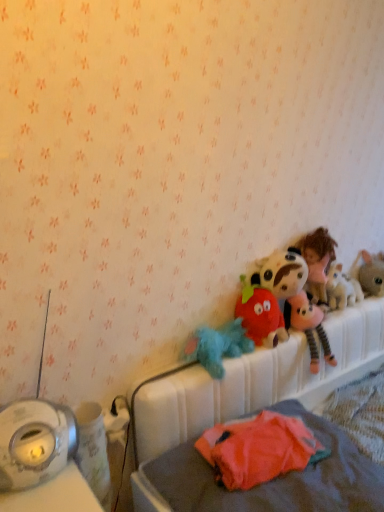
What do you see at coordinates (260, 315) in the screenshot? The height and width of the screenshot is (512, 384). I see `fluffy plush strawberry at center, arranged as the 3th toy when viewed from the right` at bounding box center [260, 315].

This screenshot has height=512, width=384. What are the coordinates of `white plastic hospital bed at upper right` in the screenshot? It's located at (252, 386).

Describe the element at coordinates (369, 273) in the screenshot. I see `fluffy gray rabbit at right, the fifth toy positioned from the left` at that location.

Identify the location of orange fabric stuffed toy at lower right, which is the second toy in left-to-right order. The height and width of the screenshot is (512, 384). (258, 449).

I want to click on fluffy blue plush at center, the fifth toy viewed from the right, so click(217, 346).

This screenshot has height=512, width=384. What do you see at coordinates (217, 346) in the screenshot?
I see `fluffy blue plush at center, the fifth toy viewed from the right` at bounding box center [217, 346].

At what (x,y) coordinates should I click in order to perform the action: click on fluffy plush strawberry at center, which is the third toy in left-to-right order. Please return your answer as a coordinate pair (x, y). The height and width of the screenshot is (512, 384). Looking at the image, I should click on (260, 315).

Which is more distant, (220, 426) or (335, 289)?

Positioned behind is point (335, 289).

Where is `the 3rd toy above when counting from the orange fabric stuffed toy at lower right, the 4th toy positioned from the right (from the image's perspective)`? Image resolution: width=384 pixels, height=512 pixels. the 3rd toy above when counting from the orange fabric stuffed toy at lower right, the 4th toy positioned from the right (from the image's perspective) is located at coordinates (342, 289).

How much distance is there between orange fabric stuffed toy at lower right, which is the second toy in left-to-right order, and fluffy plush toy at upper right, which is the second toy from right to left?

26.37 inches.

Does orange fabric stuffed toy at lower right, which is the second toy in left-to-right order, appear on the right side of fluffy plush toy at upper right, which is the second toy from right to left?

No.

Which object is positioned more to the left, fluffy plush toy at upper right, which is the second toy from right to left, or fluffy pink plush at upper right?

Positioned to the left is fluffy pink plush at upper right.

Is fluffy plush toy at upper right, arranged as the fourth toy when viewed from the left, far from fluffy pink plush at upper right?

No, fluffy plush toy at upper right, arranged as the fourth toy when viewed from the left, is not far away from fluffy pink plush at upper right.

Find the location of `the 1st toy behind the fluffy pink plush at upper right, counting from the anchor's position`. the 1st toy behind the fluffy pink plush at upper right, counting from the anchor's position is located at coordinates (342, 289).

Choose the correct answer: Is fluffy plush toy at upper right, which is the second toy from right to left, inside fluffy pink plush at upper right or outside it?

fluffy plush toy at upper right, which is the second toy from right to left, is inside fluffy pink plush at upper right.

Who is shorter, white plastic hospital bed at upper right or orange fabric stuffed toy at lower right, which is the second toy in left-to-right order?

With less height is orange fabric stuffed toy at lower right, which is the second toy in left-to-right order.

Considering the sizes of white plastic hospital bed at upper right and orange fabric stuffed toy at lower right, which is the second toy in left-to-right order, in the image, is white plastic hospital bed at upper right bigger or smaller than orange fabric stuffed toy at lower right, which is the second toy in left-to-right order,?

In the image, white plastic hospital bed at upper right appears to be larger than orange fabric stuffed toy at lower right, which is the second toy in left-to-right order.

Image resolution: width=384 pixels, height=512 pixels. There is a white plastic hospital bed at upper right. What are the coordinates of `the 1st toy above it (from a real-world perspective)` in the screenshot? It's located at (258, 449).

Can you confirm if white plastic hospital bed at upper right is thinner than orange fabric stuffed toy at lower right, which is the second toy in left-to-right order?

No.

From the picture: Is fluffy blue plush at center, placed as the first toy when sorted from left to right, directly adjacent to white plastic hospital bed at upper right?

No, fluffy blue plush at center, placed as the first toy when sorted from left to right, is not with white plastic hospital bed at upper right.

Is fluffy blue plush at center, placed as the first toy when sorted from left to right, to the right of white plastic hospital bed at upper right from the viewer's perspective?

No.

Can you tell me how much fluffy blue plush at center, the fifth toy viewed from the right, and white plastic hospital bed at upper right differ in facing direction?

The angle between the facing direction of fluffy blue plush at center, the fifth toy viewed from the right, and the facing direction of white plastic hospital bed at upper right is 0.000748 degrees.

Is fluffy blue plush at center, the fifth toy viewed from the right, oriented towards white plastic hospital bed at upper right?

No, fluffy blue plush at center, the fifth toy viewed from the right, is not turned towards white plastic hospital bed at upper right.

Is orange fabric stuffed toy at lower right, which is the second toy in left-to-right order, facing away from fluffy gray rabbit at right, the fifth toy positioned from the left?

No, orange fabric stuffed toy at lower right, which is the second toy in left-to-right order, is not facing the opposite direction of fluffy gray rabbit at right, the fifth toy positioned from the left.

From the image's perspective, who appears lower, orange fabric stuffed toy at lower right, the 4th toy positioned from the right, or fluffy gray rabbit at right, the fifth toy positioned from the left?

orange fabric stuffed toy at lower right, the 4th toy positioned from the right, appears lower in the image.

The width and height of the screenshot is (384, 512). I want to click on toy that is the 4th object located behind the orange fabric stuffed toy at lower right, which is the second toy in left-to-right order, so click(x=369, y=273).

From the picture: Is fluffy gray rabbit at right, which is the 1th toy in right-to-left order, completely or partially inside orange fabric stuffed toy at lower right, which is the second toy in left-to-right order?

Definitely not — fluffy gray rabbit at right, which is the 1th toy in right-to-left order, is not inside orange fabric stuffed toy at lower right, which is the second toy in left-to-right order.

Between fluffy plush toy at upper right, arranged as the fourth toy when viewed from the left, and white plastic hospital bed at upper right, which one is positioned in front?

white plastic hospital bed at upper right is more forward.

From the image's perspective, is fluffy plush toy at upper right, which is the second toy from right to left, on white plastic hospital bed at upper right?

Yes.

Is fluffy plush toy at upper right, arranged as the fourth toy when viewed from the left, wider or thinner than white plastic hospital bed at upper right?

fluffy plush toy at upper right, arranged as the fourth toy when viewed from the left, is thinner than white plastic hospital bed at upper right.

The width and height of the screenshot is (384, 512). In the image, there is a fluffy plush toy at upper right, arranged as the fourth toy when viewed from the left. Find the location of `hospital bed below it (from a real-world perspective)`. hospital bed below it (from a real-world perspective) is located at coordinates (252, 386).

Can you confirm if fluffy plush toy at upper right, which is the second toy from right to left, is shorter than fluffy plush strawberry at center, which is the third toy in left-to-right order?

Yes.

Is fluffy plush toy at upper right, arranged as the fourth toy when viewed from the left, not within fluffy plush strawberry at center, arranged as the 3th toy when viewed from the right?

That's correct, fluffy plush toy at upper right, arranged as the fourth toy when viewed from the left, is outside of fluffy plush strawberry at center, arranged as the 3th toy when viewed from the right.

From the image's perspective, between fluffy plush toy at upper right, which is the second toy from right to left, and fluffy plush strawberry at center, arranged as the 3th toy when viewed from the right, which one is located above?

fluffy plush toy at upper right, which is the second toy from right to left, is shown above in the image.

From the fluffy plush toy at upper right, which is the second toy from right to left, count the 1st toy to the left and point to it. Please provide its 2D coordinates.

[(260, 315)]

Which toy is the 2nd one when counting from the left side of the fluffy plush toy at upper right, arranged as the fourth toy when viewed from the left? Please provide its 2D coordinates.

[(258, 449)]

Locate an element on the screen. The width and height of the screenshot is (384, 512). the 3rd toy located beneath the fluffy pink plush at upper right (from a real-world perspective) is located at coordinates (342, 289).

Which object lies further to the anchor point fluffy plush toy at upper right, which is the second toy from right to left, orange fabric stuffed toy at lower right, the 4th toy positioned from the right, or white plastic hospital bed at upper right?

orange fabric stuffed toy at lower right, the 4th toy positioned from the right.

Looking at the image, which one is located further to fluffy plush strawberry at center, arranged as the 3th toy when viewed from the right, white plastic hospital bed at upper right or fluffy gray rabbit at right, which is the 1th toy in right-to-left order?

fluffy gray rabbit at right, which is the 1th toy in right-to-left order, lies further to fluffy plush strawberry at center, arranged as the 3th toy when viewed from the right, than the other object.

In the scene shown: From the image, which object appears to be farther from fluffy plush toy at upper right, arranged as the fourth toy when viewed from the left, orange fabric stuffed toy at lower right, which is the second toy in left-to-right order, or fluffy gray rabbit at right, which is the 1th toy in right-to-left order?

orange fabric stuffed toy at lower right, which is the second toy in left-to-right order.

Which object lies nearer to the anchor point white plastic hospital bed at upper right, fluffy blue plush at center, placed as the first toy when sorted from left to right, or fluffy gray rabbit at right, the fifth toy positioned from the left?

fluffy blue plush at center, placed as the first toy when sorted from left to right.

Based on their spatial positions, is fluffy pink plush at upper right or fluffy gray rabbit at right, which is the 1th toy in right-to-left order, closer to orange fabric stuffed toy at lower right, the 4th toy positioned from the right?

The object closer to orange fabric stuffed toy at lower right, the 4th toy positioned from the right, is fluffy pink plush at upper right.

From the image, which object appears to be nearer to orange fabric stuffed toy at lower right, which is the second toy in left-to-right order, fluffy blue plush at center, placed as the first toy when sorted from left to right, or white plastic hospital bed at upper right?

Among the two, white plastic hospital bed at upper right is located nearer to orange fabric stuffed toy at lower right, which is the second toy in left-to-right order.

Which object lies nearer to the anchor point fluffy plush toy at upper right, arranged as the fourth toy when viewed from the left, orange fabric stuffed toy at lower right, the 4th toy positioned from the right, or fluffy blue plush at center, placed as the first toy when sorted from left to right?

fluffy blue plush at center, placed as the first toy when sorted from left to right, lies closer to fluffy plush toy at upper right, arranged as the fourth toy when viewed from the left, than the other object.

Based on their spatial positions, is fluffy plush strawberry at center, which is the third toy in left-to-right order, or orange fabric stuffed toy at lower right, which is the second toy in left-to-right order, further from fluffy pink plush at upper right?

orange fabric stuffed toy at lower right, which is the second toy in left-to-right order, is further to fluffy pink plush at upper right.

Locate an element on the screen. person between fluffy blue plush at center, the fifth toy viewed from the right, and fluffy gray rabbit at right, which is the 1th toy in right-to-left order, in the horizontal direction is located at coordinates (317, 247).

Locate an element on the screen. The image size is (384, 512). person between white plastic hospital bed at upper right and fluffy gray rabbit at right, the fifth toy positioned from the left, from front to back is located at coordinates (317, 247).

This screenshot has height=512, width=384. What are the coordinates of `person located between fluffy plush strawberry at center, which is the third toy in left-to-right order, and fluffy gray rabbit at right, the fifth toy positioned from the left, in the left-right direction` in the screenshot? It's located at (317, 247).

This screenshot has width=384, height=512. Identify the location of toy between fluffy plush strawberry at center, arranged as the 3th toy when viewed from the right, and orange fabric stuffed toy at lower right, which is the second toy in left-to-right order, from top to bottom. (217, 346).